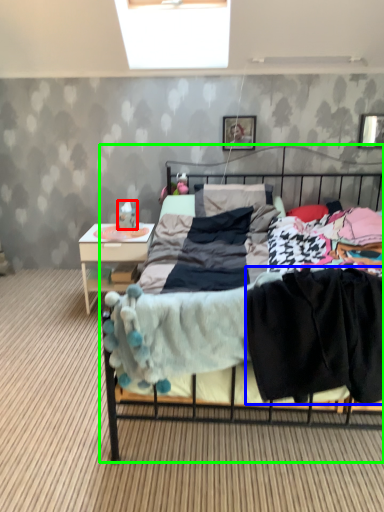
Question: Which is farther away from toy (highlighted by a red box)? clothing (highlighted by a blue box) or bed (highlighted by a green box)?

Choices:
 (A) clothing
 (B) bed

Answer: (A)